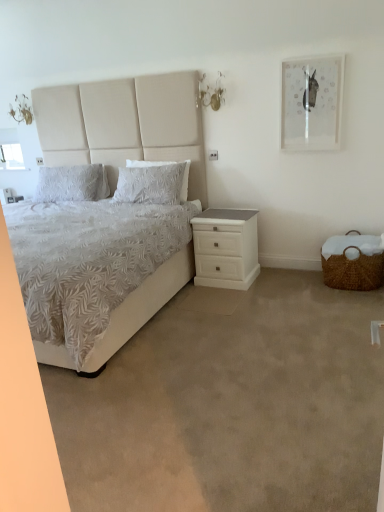
Question: Is white textured pillow at upper left, the 1th pillow positioned from the left, wider or thinner than white fabric bed at left?

Choices:
 (A) wide
 (B) thin

Answer: (B)

Question: Is white textured pillow at upper left, which is the second pillow in right-to-left order, inside the boundaries of white fabric bed at left, or outside?

Choices:
 (A) inside
 (B) outside

Answer: (A)

Question: Which object is the farthest from the white textured pillow at center, placed as the first pillow when sorted from right to left?

Choices:
 (A) beige carpet at lower center
 (B) white textured pillow at upper left, which is the second pillow in right-to-left order
 (C) white matte nightstand at lower right
 (D) matte white picture frame at upper right
 (E) woven brown basket at lower right

Answer: (A)

Question: Which object is the farthest from the white textured pillow at center, the second pillow when ordered from left to right?

Choices:
 (A) white fabric bed at left
 (B) beige carpet at lower center
 (C) white matte nightstand at lower right
 (D) matte white picture frame at upper right
 (E) woven brown basket at lower right

Answer: (B)